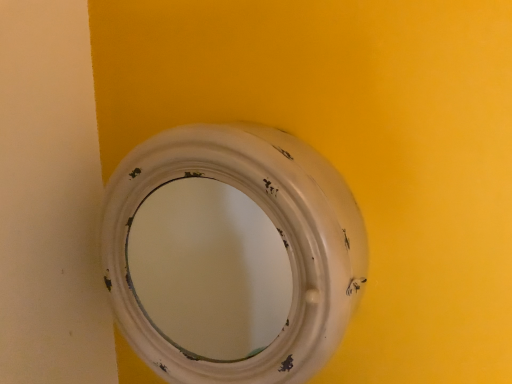
Describe the element at coordinates (276, 230) in the screenshot. The image size is (512, 384). I see `white chipped paint mirror at upper center` at that location.

You are a GUI agent. You are given a task and a screenshot of the screen. Output one action in this format:
    pyautogui.click(x=<x>, y=<y>)
    Task: Click on the white chipped paint mirror at upper center
    The height and width of the screenshot is (384, 512).
    Given the screenshot: What is the action you would take?
    pyautogui.click(x=276, y=230)

Locate an element on the screen. Image resolution: width=512 pixels, height=384 pixels. white chipped paint mirror at upper center is located at coordinates (276, 230).